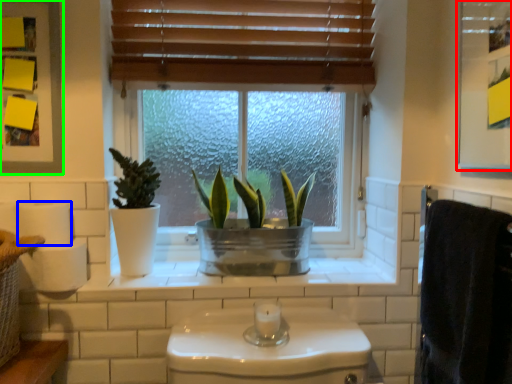
Question: Considering the real-world distances, which object is closest to medicine cabinet (highlighted by a red box)? toilet paper (highlighted by a blue box) or medicine cabinet (highlighted by a green box).

Choices:
 (A) toilet paper
 (B) medicine cabinet

Answer: (B)